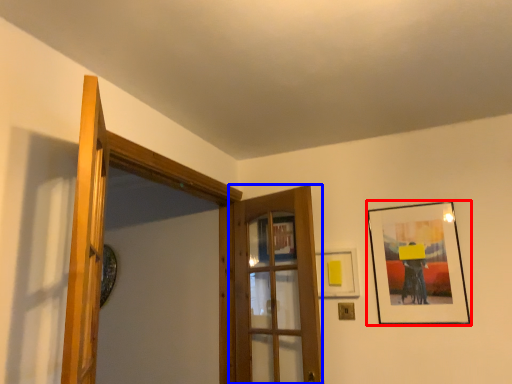
Question: Which object appears farthest to the camera in this image, picture frame (highlighted by a red box) or door (highlighted by a blue box)?

Choices:
 (A) picture frame
 (B) door

Answer: (A)